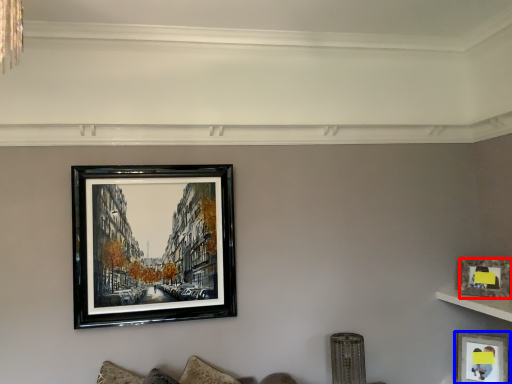
Question: Which point is closer to the camera, picture frame (highlighted by a red box) or picture frame (highlighted by a blue box)?

Choices:
 (A) picture frame
 (B) picture frame

Answer: (A)